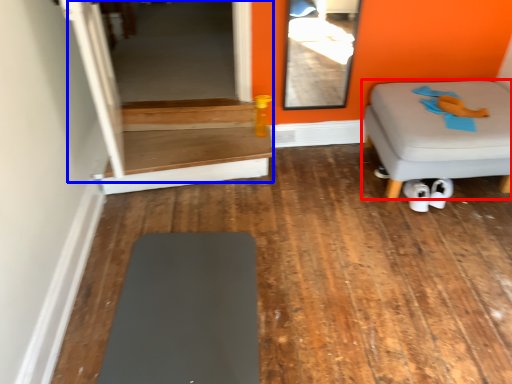
Question: Which object is further to the camera taking this photo, furniture (highlighted by a red box) or glass door (highlighted by a blue box)?

Choices:
 (A) furniture
 (B) glass door

Answer: (B)